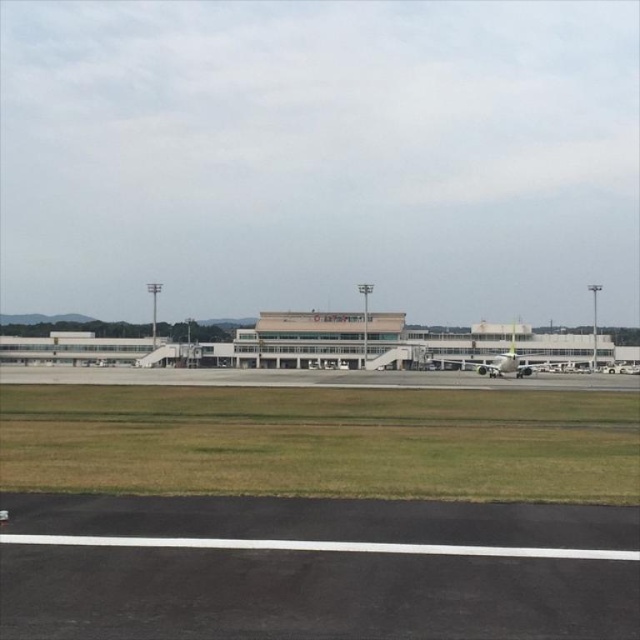
Can you confirm if black asphalt tarmac at lower center is positioned above white glossy airplane at center?

Correct, black asphalt tarmac at lower center is located above white glossy airplane at center.

Does black asphalt tarmac at lower center come in front of white glossy airplane at center?

Yes, it is in front of white glossy airplane at center.

Which is behind, point (284, 524) or point (454, 362)?

The point (454, 362) is more distant.

I want to click on black asphalt tarmac at lower center, so click(x=314, y=570).